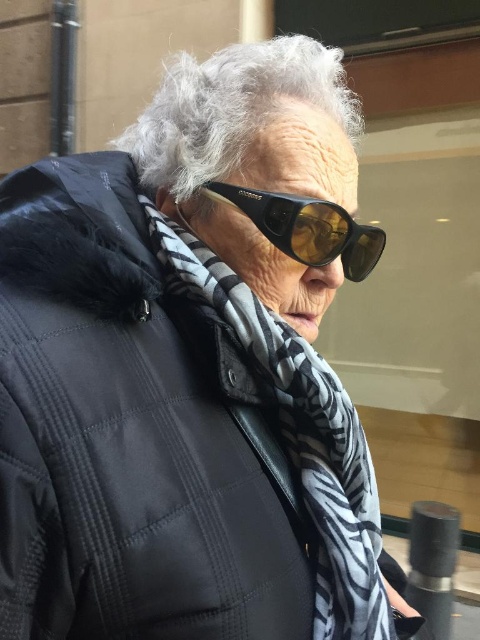
Between gray curly hair at upper center and black matte sunglasses at center, which one appears on the left side from the viewer's perspective?

Positioned to the left is gray curly hair at upper center.

This screenshot has height=640, width=480. What do you see at coordinates (230, 108) in the screenshot? I see `gray curly hair at upper center` at bounding box center [230, 108].

Where is `gray curly hair at upper center`? gray curly hair at upper center is located at coordinates pyautogui.click(x=230, y=108).

This screenshot has width=480, height=640. In order to click on gray curly hair at upper center in this screenshot , I will do `click(230, 108)`.

Which is more to the right, black and white patterned scarf at center or gray curly hair at upper center?

From the viewer's perspective, black and white patterned scarf at center appears more on the right side.

Is black and white patterned scarf at center above gray curly hair at upper center?

No.

Which is behind, point (290, 406) or point (133, 156)?

Point (133, 156)

Where is `black and white patterned scarf at center`? The image size is (480, 640). black and white patterned scarf at center is located at coordinates (300, 436).

Can you confirm if black and white patterned scarf at center is shorter than black matte sunglasses at center?

In fact, black and white patterned scarf at center may be taller than black matte sunglasses at center.

Is point (339, 636) positioned behind point (365, 273)?

No, (339, 636) is in front of (365, 273).

This screenshot has width=480, height=640. I want to click on black and white patterned scarf at center, so click(x=300, y=436).